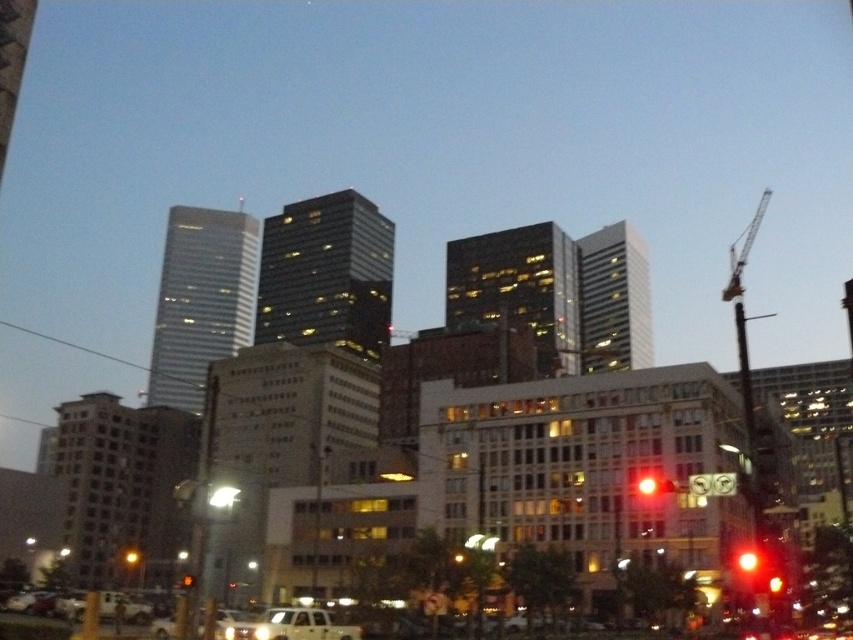
You are a delivery driver approaching the intersection and need to know the exact position of the white matte van at lower center. Can you confirm its location using the coordinate system provided?

The white matte van at lower center is located at point coordinates (291, 625).